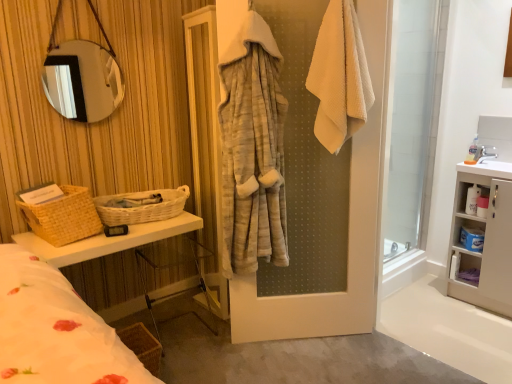
Question: Do you think brown woven basket at lower left, acting as the third basket starting from the top, is within transparent glass screen door at right, or outside of it?

Choices:
 (A) inside
 (B) outside

Answer: (B)

Question: Considering the positions of point (138, 326) and point (414, 215), is point (138, 326) closer or farther from the camera than point (414, 215)?

Choices:
 (A) closer
 (B) farther

Answer: (A)

Question: Which object is the closest to the blue plastic container at right, the second cabinet from the top?

Choices:
 (A) white plastic cabinet at right, which is the 2th cabinet from bottom to top
 (B) white matte cabinet at right
 (C) woven wicker vanity at left
 (D) woven beige basket at left, which appears as the third basket when viewed from the right
 (E) transparent glass screen door at right

Answer: (A)

Question: Which of these objects is positioned closest to the white glossy sink at upper right?

Choices:
 (A) blue plastic container at right, the second cabinet from the top
 (B) white plastic cabinet at right, which ranks as the 1th cabinet in top-to-bottom order
 (C) brown woven basket at lower left, which ranks as the 3th basket in left-to-right order
 (D) transparent glass screen door at right
 (E) woven wicker basket at left, which ranks as the second basket in left-to-right order

Answer: (B)